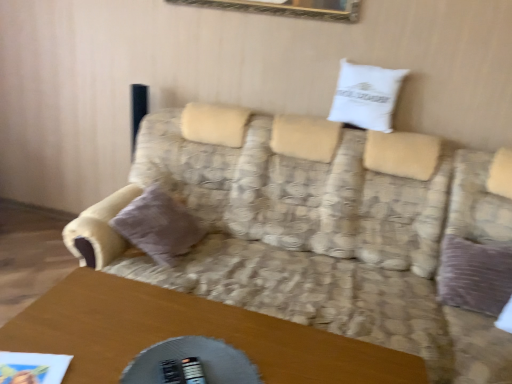
In order to click on free space above wooden table at lower center (from a real-world perspective) in this screenshot , I will do `click(189, 345)`.